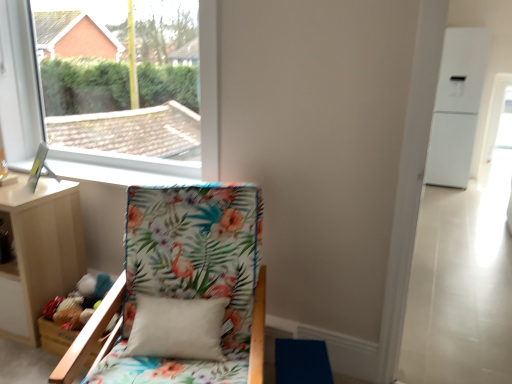
Question: Is light wood nightstand at lower left far away from floral fabric chair at lower left?

Choices:
 (A) yes
 (B) no

Answer: (B)

Question: Is light wood nightstand at lower left smaller than floral fabric chair at lower left?

Choices:
 (A) no
 (B) yes

Answer: (B)

Question: Is light wood nightstand at lower left taller than floral fabric chair at lower left?

Choices:
 (A) no
 (B) yes

Answer: (A)

Question: Does light wood nightstand at lower left lie in front of floral fabric chair at lower left?

Choices:
 (A) yes
 (B) no

Answer: (B)

Question: Considering the relative sizes of light wood nightstand at lower left and floral fabric chair at lower left in the image provided, is light wood nightstand at lower left bigger than floral fabric chair at lower left?

Choices:
 (A) yes
 (B) no

Answer: (B)

Question: From a real-world perspective, is white plastic window at upper left above or below light wood nightstand at lower left?

Choices:
 (A) above
 (B) below

Answer: (A)

Question: In terms of height, does white plastic window at upper left look taller or shorter compared to light wood nightstand at lower left?

Choices:
 (A) short
 (B) tall

Answer: (B)

Question: In terms of width, does white plastic window at upper left look wider or thinner when compared to light wood nightstand at lower left?

Choices:
 (A) thin
 (B) wide

Answer: (A)

Question: Is white plastic window at upper left in front of or behind light wood nightstand at lower left in the image?

Choices:
 (A) behind
 (B) front

Answer: (B)

Question: Considering the positions of point (11, 24) and point (158, 380), is point (11, 24) closer or farther from the camera than point (158, 380)?

Choices:
 (A) closer
 (B) farther

Answer: (B)

Question: Considering their positions, is white plastic window at upper left located in front of or behind floral fabric chair at lower left?

Choices:
 (A) front
 (B) behind

Answer: (B)

Question: From the image's perspective, is white plastic window at upper left positioned above or below floral fabric chair at lower left?

Choices:
 (A) below
 (B) above

Answer: (B)

Question: Is white plastic window at upper left spatially inside floral fabric chair at lower left, or outside of it?

Choices:
 (A) outside
 (B) inside

Answer: (A)

Question: In the image, is light wood nightstand at lower left on the left side or the right side of white plastic window at upper left?

Choices:
 (A) right
 (B) left

Answer: (B)

Question: From the image's perspective, is light wood nightstand at lower left positioned above or below white plastic window at upper left?

Choices:
 (A) below
 (B) above

Answer: (A)